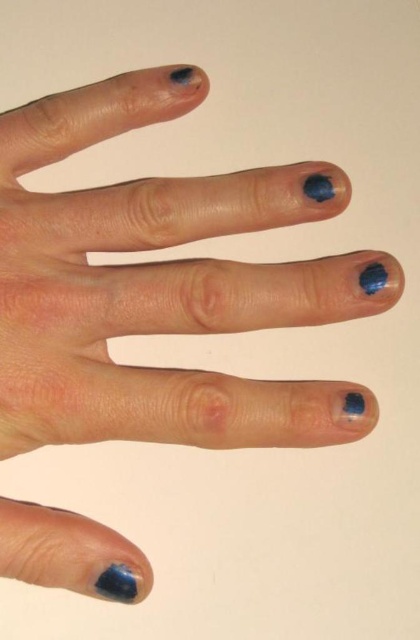
You are a photographer trying to capture a close up of the hand in the scene. The camera you are using has a focal length of 50mm. If you want to maintain the same composition but increase the distance between the matte blue nail polish at upper center and the thumb, how should you adjust the focal length?

To increase the distance between the matte blue nail polish at upper center and the thumb, you should decrease the focal length. A shorter focal length will widen the field of view, causing elements in the scene to appear more spread out, thereby increasing the apparent distance between them.

You are a photographer trying to capture a closeup of the matte blue nail polish at lower left and the matte blue nail polish at upper center. Which one will appear larger in the photo?

The matte blue nail polish at lower left will appear larger in the photo because it is closer to the camera than the matte blue nail polish at upper center.

You are an artist trying to paint a hand with two matte blue nail polish areas. You see the matte blue nail polish at lower left and the matte blue nail polish at upper center. Which one is located more to the left?

The matte blue nail polish at lower left is positioned on the left side of matte blue nail polish at upper center, so it is more to the left.